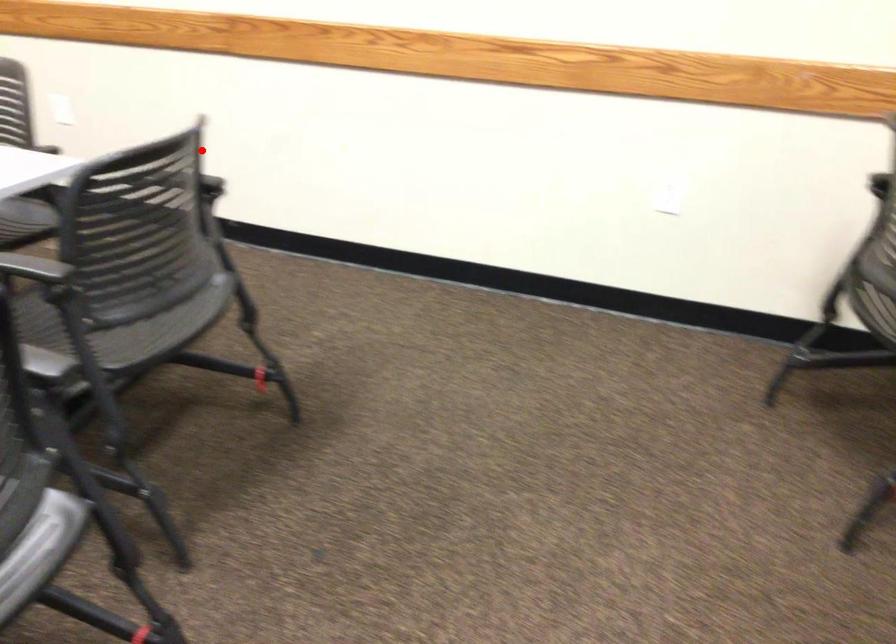
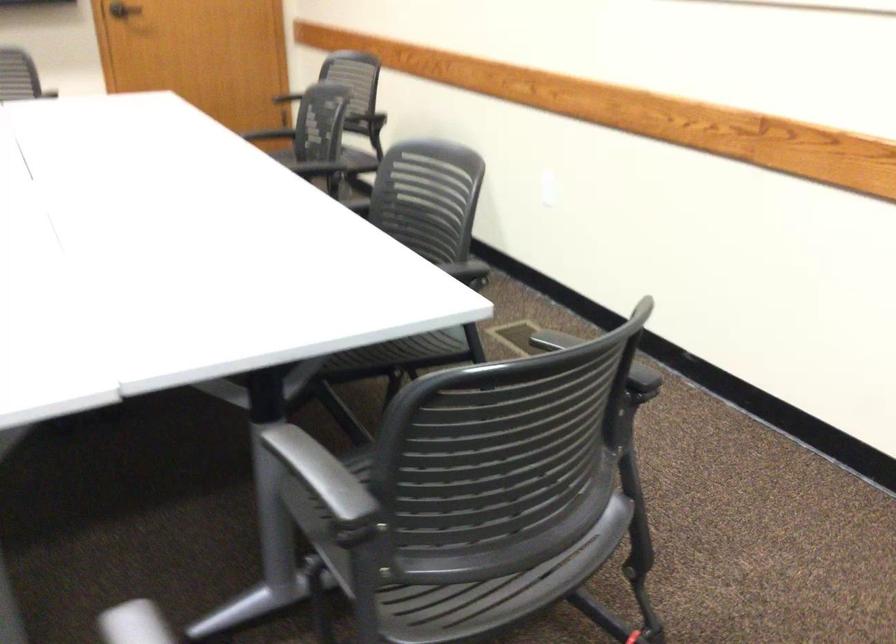
Question: I am providing you with two images of the same scene from different viewpoints. A red point is marked on the first image. Is the red point's position out of view in image 2?

Choices:
 (A) Yes
 (B) No

Answer: (B)